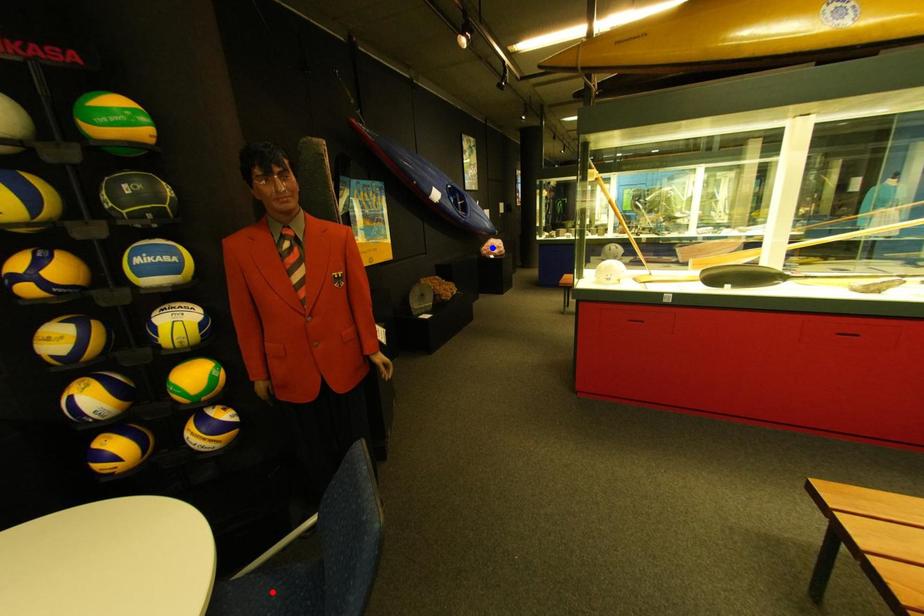
Question: Two points are marked on the image. Which point is closer to the camera?

Choices:
 (A) Blue point is closer.
 (B) Red point is closer.

Answer: (B)